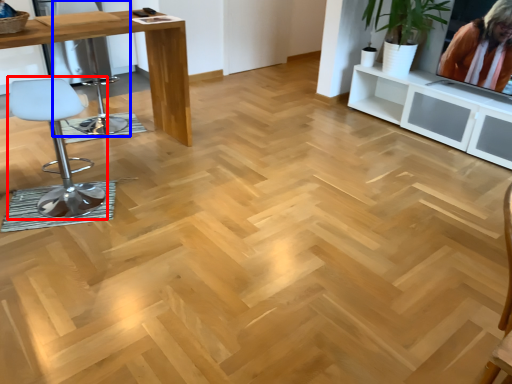
Question: Which object is further to the camera taking this photo, chair (highlighted by a red box) or swivel chair (highlighted by a blue box)?

Choices:
 (A) chair
 (B) swivel chair

Answer: (B)